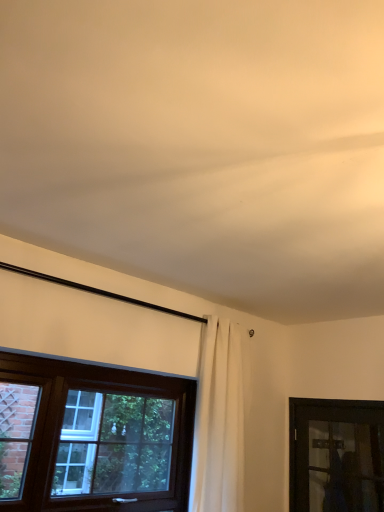
Question: From a real-world perspective, is white fabric curtain at center positioned under transparent glass door at lower right, which ranks as the second window in left-to-right order, based on gravity?

Choices:
 (A) no
 (B) yes

Answer: (A)

Question: Is transparent glass door at lower right, marked as the 1th window in a right-to-left arrangement, a part of white fabric curtain at center?

Choices:
 (A) no
 (B) yes

Answer: (A)

Question: From a real-world perspective, is white fabric curtain at center over transparent glass door at lower right, marked as the 1th window in a right-to-left arrangement?

Choices:
 (A) yes
 (B) no

Answer: (A)

Question: Does white fabric curtain at center appear on the right side of transparent glass door at lower right, which ranks as the second window in left-to-right order?

Choices:
 (A) yes
 (B) no

Answer: (B)

Question: Is white fabric curtain at center not close to transparent glass door at lower right, which ranks as the second window in left-to-right order?

Choices:
 (A) yes
 (B) no

Answer: (B)

Question: Is white fabric curtain at center at the left side of transparent glass door at lower right, marked as the 1th window in a right-to-left arrangement?

Choices:
 (A) yes
 (B) no

Answer: (A)

Question: From a real-world perspective, is brown wooden window at lower left, which appears as the 1th window when viewed from the left, physically above transparent glass door at lower right, marked as the 1th window in a right-to-left arrangement?

Choices:
 (A) yes
 (B) no

Answer: (A)

Question: From the image's perspective, is brown wooden window at lower left, which appears as the 1th window when viewed from the left, below transparent glass door at lower right, which ranks as the second window in left-to-right order?

Choices:
 (A) yes
 (B) no

Answer: (B)

Question: Is brown wooden window at lower left, which appears as the 1th window when viewed from the left, at the right side of transparent glass door at lower right, which ranks as the second window in left-to-right order?

Choices:
 (A) no
 (B) yes

Answer: (A)

Question: Can we say brown wooden window at lower left, which appears as the 2th window when viewed from the right, lies outside transparent glass door at lower right, marked as the 1th window in a right-to-left arrangement?

Choices:
 (A) no
 (B) yes

Answer: (B)

Question: Can you confirm if brown wooden window at lower left, which appears as the 2th window when viewed from the right, is bigger than transparent glass door at lower right, marked as the 1th window in a right-to-left arrangement?

Choices:
 (A) no
 (B) yes

Answer: (B)

Question: Is brown wooden window at lower left, which appears as the 1th window when viewed from the left, far from transparent glass door at lower right, marked as the 1th window in a right-to-left arrangement?

Choices:
 (A) no
 (B) yes

Answer: (B)

Question: Can you see white fabric curtain at center touching brown wooden window at lower left, which appears as the 1th window when viewed from the left?

Choices:
 (A) no
 (B) yes

Answer: (A)